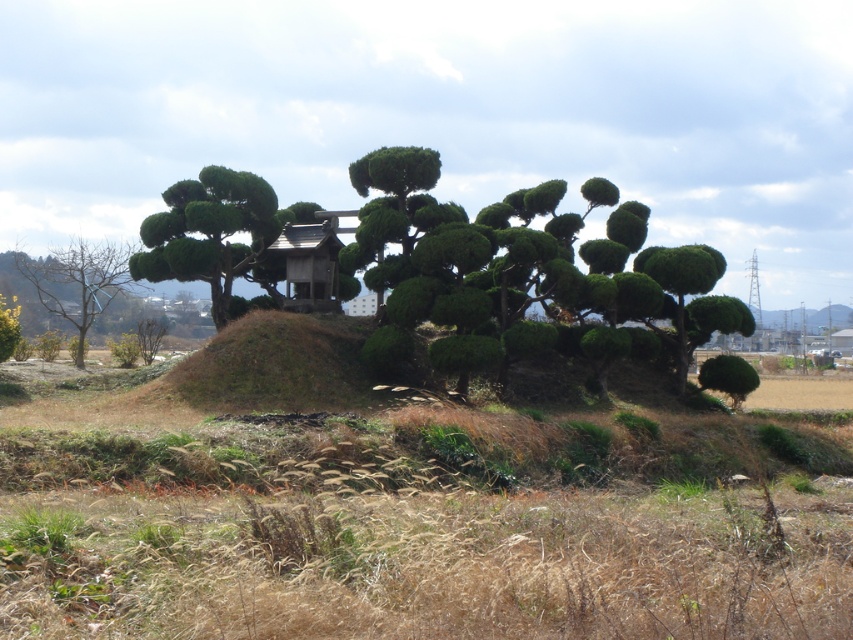
You are a landscape architect designing a garden path that must pass between the green leafy bush at center and the green textured bush at left. The path needs to be wide enough for a wheelchair to pass comfortably. Given that standard wheelchair widths are about 70 cm, can you determine if the space between these two bushes is sufficient?

The green leafy bush at center is taller than the green textured bush at left, but the description does not provide information about the horizontal distance between them. Therefore, it is impossible to determine if the space between them is wide enough for a wheelchair path based on the given details.

You are a gardener planning to prune the green leafy bush at center and the bare wood tree at left. Which one is closer to you as you stand in the middle of the field?

The green leafy bush at center is closer to you since it is in front of the bare wood tree at left.